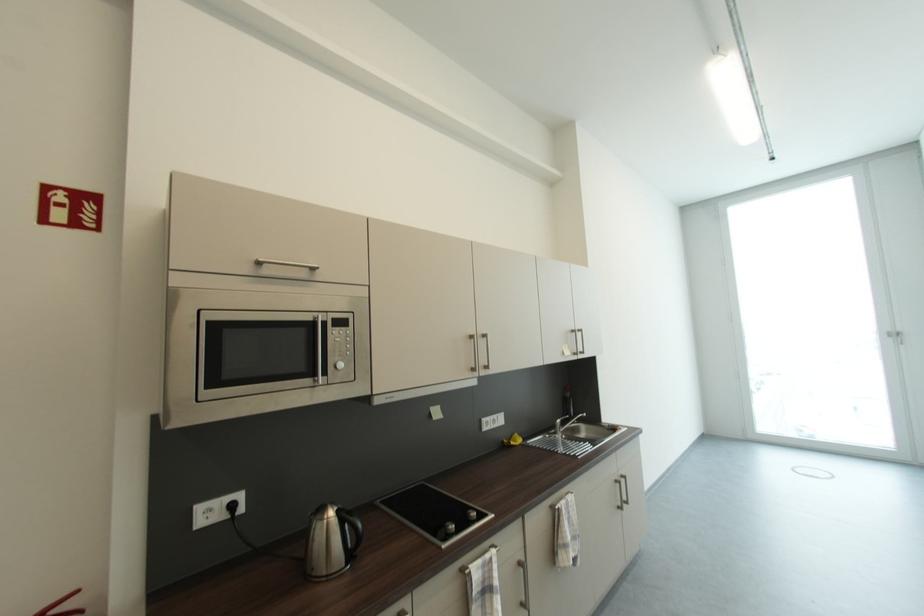
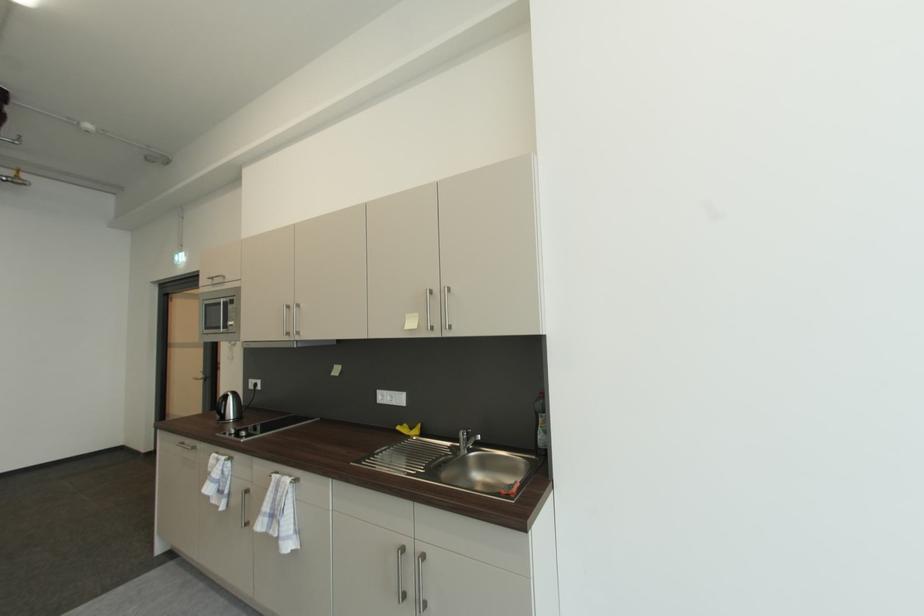
Question: I am providing you with two images of the same scene from different viewpoints. Which of the following objects are not visible in image2?

Choices:
 (A) checkered kitchen towel
 (B) door handle
 (C) black electric kettle
 (D) none of these

Answer: (D)